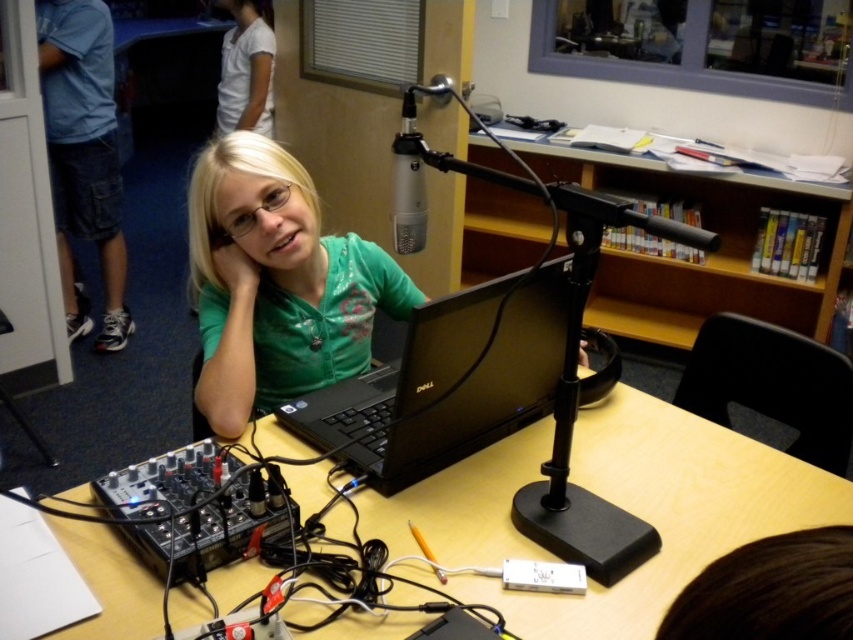
Question: Which point appears closest to the camera in this image?

Choices:
 (A) (306, 252)
 (B) (526, 262)
 (C) (701, 492)
 (D) (469, 321)

Answer: (D)

Question: Is wooden bookshelf at upper center further to the viewer compared to white cotton shirt at upper left?

Choices:
 (A) yes
 (B) no

Answer: (B)

Question: Which point is closer to the camera taking this photo?

Choices:
 (A) (456, 536)
 (B) (268, 74)
 (C) (431, 413)

Answer: (A)

Question: Does green matte shirt at center have a larger size compared to white cotton shirt at upper left?

Choices:
 (A) no
 (B) yes

Answer: (A)

Question: Where is green matte shirt at center located in relation to wooden bookshelf at upper center in the image?

Choices:
 (A) left
 (B) right

Answer: (A)

Question: Which point is farther to the camera?

Choices:
 (A) wooden bookshelf at upper center
 (B) green matte shirt at center
 (C) black matte laptop at center

Answer: (A)